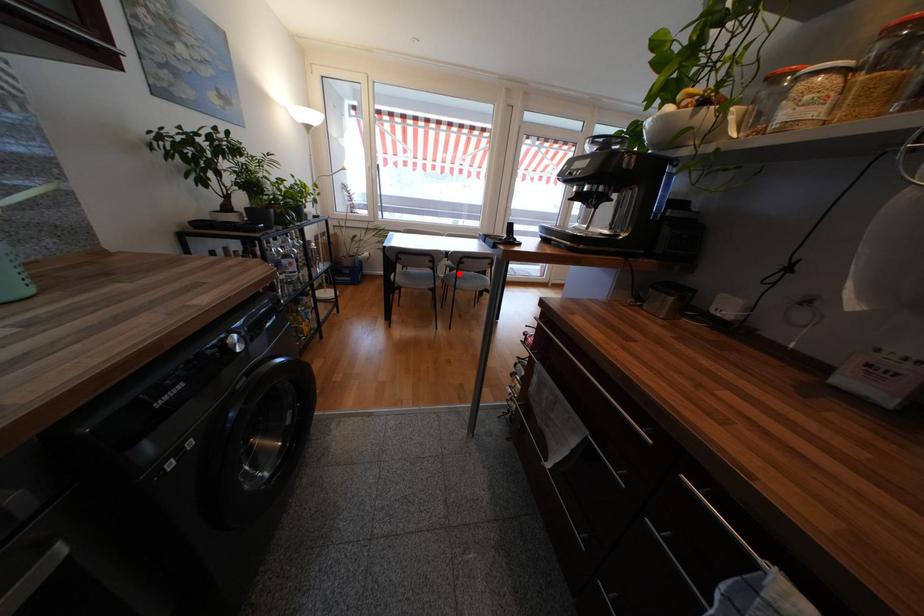
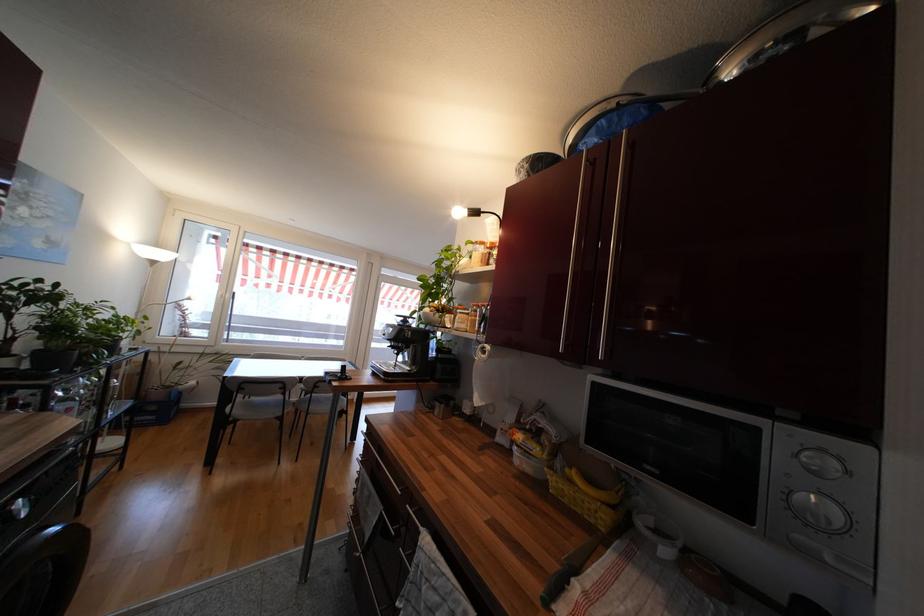
In the second image, find the point that corresponds to the highlighted location in the first image.

(313, 398)